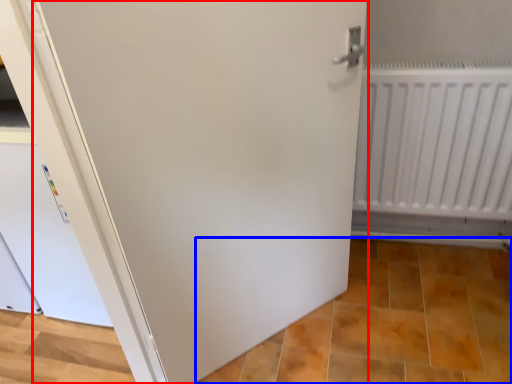
Question: Which object is further to the camera taking this photo, door (highlighted by a red box) or tile (highlighted by a blue box)?

Choices:
 (A) door
 (B) tile

Answer: (B)